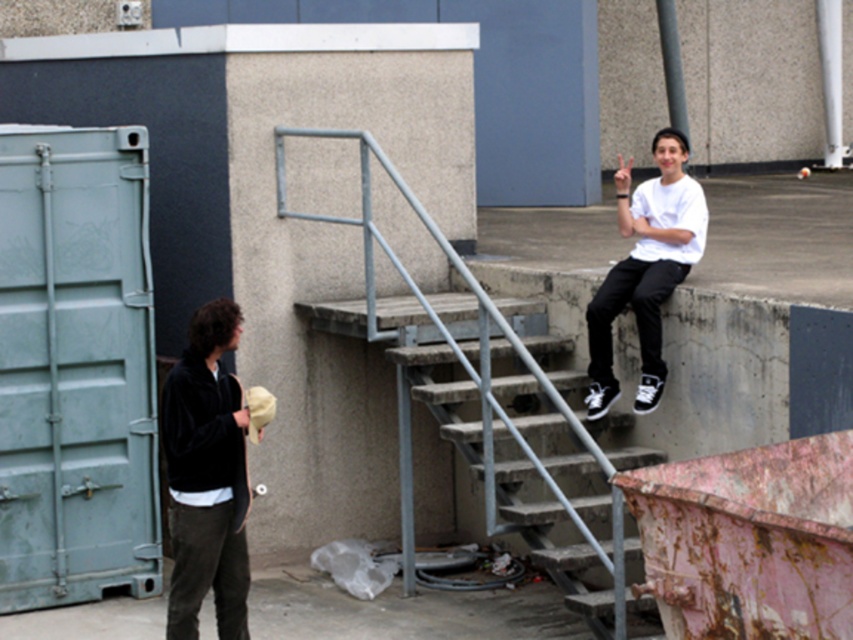
You are a tailor measuring for alterations. You need to determine if the distance between the black velvet jacket at left and the white matte shirt at upper right is sufficient to allow a 3 meter long tape measure to stretch between them without bending. Can you confirm this?

The distance between the black velvet jacket at left and the white matte shirt at upper right is 2.91 meters, which is slightly less than the 3 meter tape measure. Therefore, the tape measure would need to bend or the distance is insufficient to fully extend the tape measure between them.

You are standing in the urban outdoor setting and want to determine which of the two points, point (178, 362) or point (666, 211), is closer to you. Based on the scene description, which point is nearer?

Point (178, 362) is closer to the viewer than point (666, 211).

You are a fashion designer observing the urban scene. You notice the black velvet jacket at left and the white matte shirt at upper right. Which clothing item is located to the left of the other?

The black velvet jacket at left is positioned on the left side of white matte shirt at upper right.